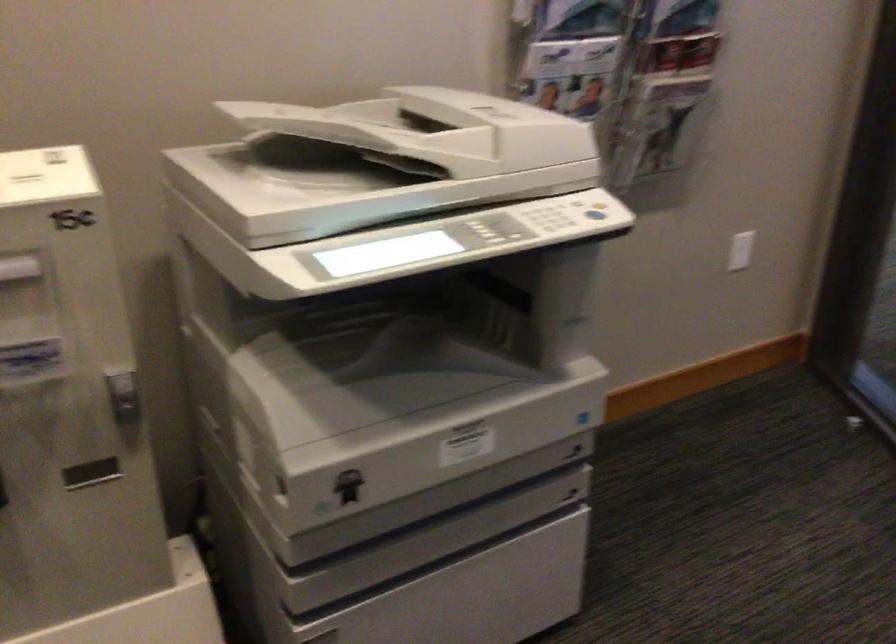
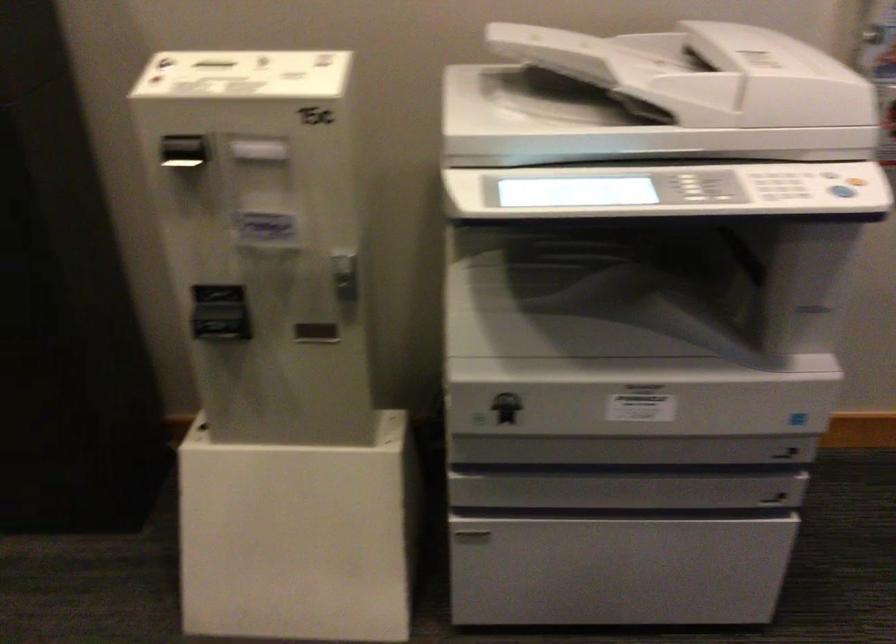
Question: I am providing you with two images of the same scene from different viewpoints. After the viewpoint changes to image2, which objects are now occluded?

Choices:
 (A) scanner lid
 (B) orange power button
 (C) dispenser slot
 (D) none of these

Answer: (D)